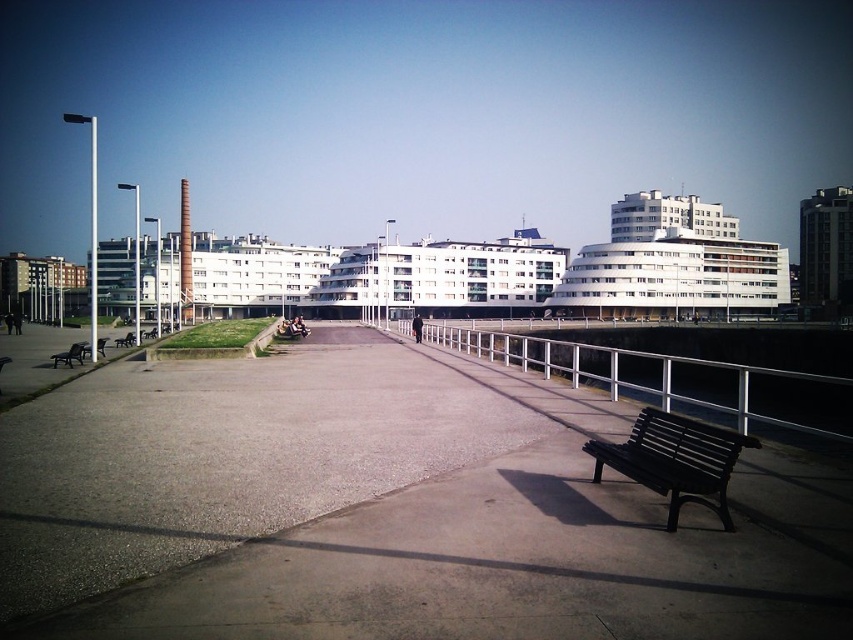
You are standing on the gray concrete pavement at center and want to sit down. Is the black wooden bench at left located above or below you?

The gray concrete pavement at center is below the black wooden bench at left, so the bench is above you.

You are a visitor standing on the walkway and want to sit down. You see the white metal rail at center and the wooden bench at center. Which object is closer to the water?

The white metal rail at center is positioned under the wooden bench at center, meaning it is closer to the water.

You are a visitor at the waterfront and want to sit on the wooden bench at center. However, you notice there is a dark brown wooden bench at lower right nearby. Which bench is closer to the metal railing bordering the water?

The dark brown wooden bench at lower right is positioned on the right side of wooden bench at center, so it is closer to the metal railing bordering the water.